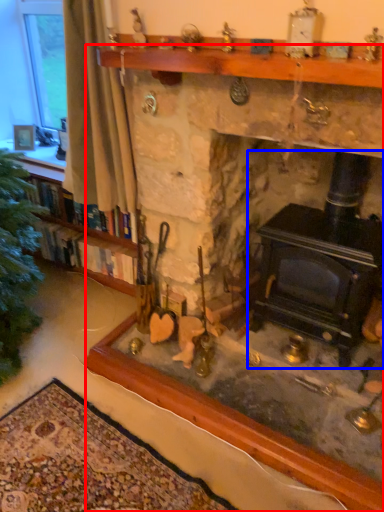
Question: Which object is further to the camera taking this photo, fireplace (highlighted by a red box) or wood burning stove (highlighted by a blue box)?

Choices:
 (A) fireplace
 (B) wood burning stove

Answer: (B)